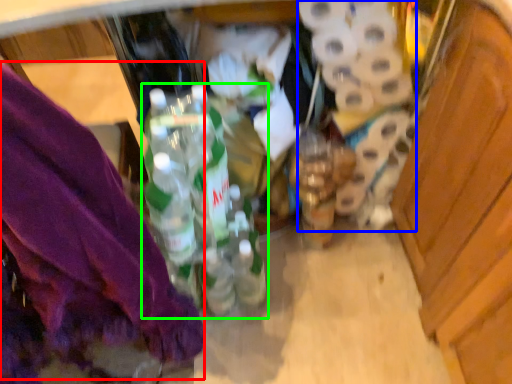
Question: Estimate the real-world distances between objects in this image. Which object is closer to underclothes (highlighted by a red box), toilet paper (highlighted by a blue box) or bottle (highlighted by a green box)?

Choices:
 (A) toilet paper
 (B) bottle

Answer: (B)